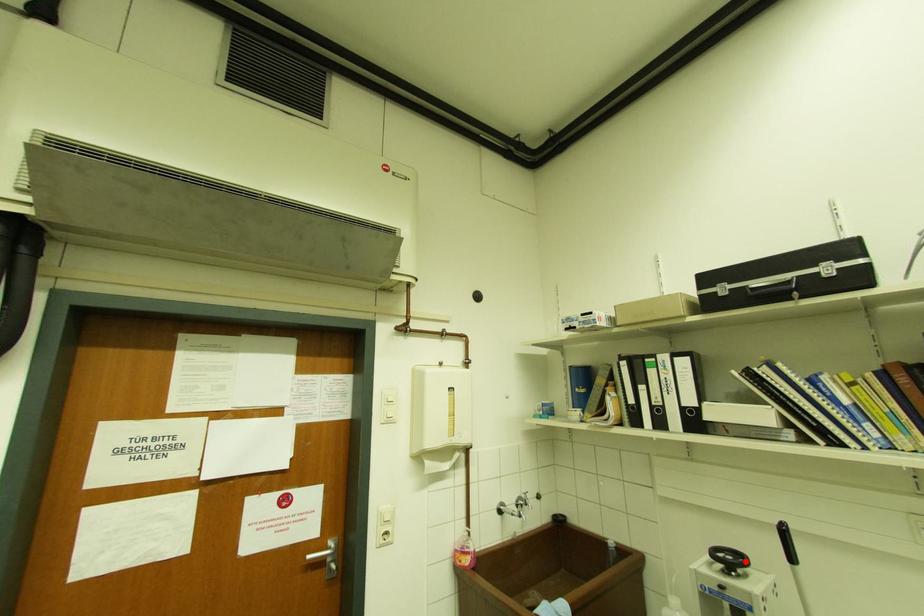
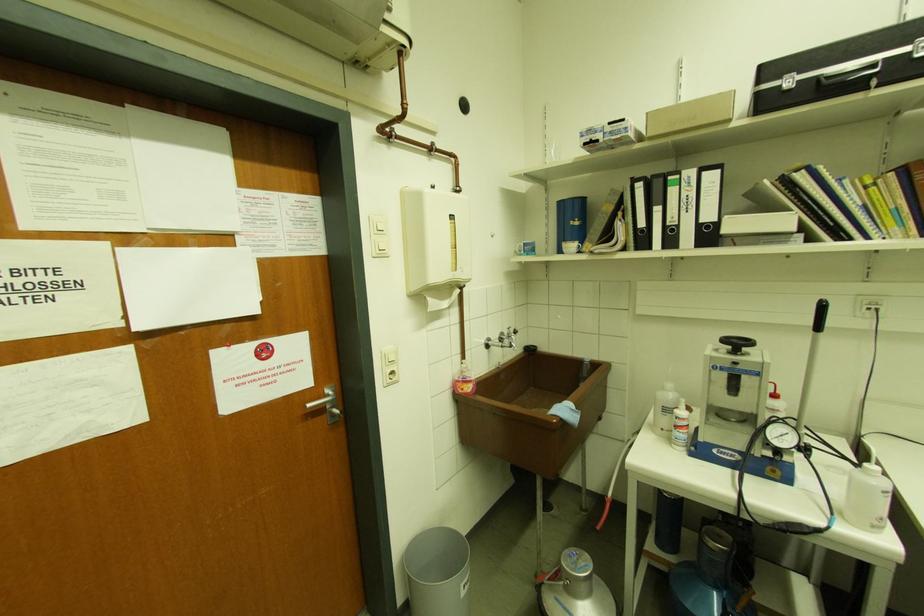
In the second image, find the point that corresponds to the highlighted location in the first image.

(752, 344)